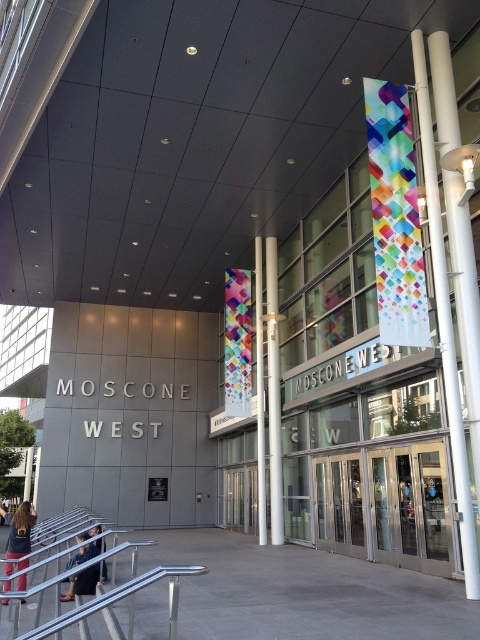
Between white glossy pillar at center and dark blue jacket at lower left, which one has less height?

dark blue jacket at lower left

Between white glossy pillar at center and dark blue jacket at lower left, which one appears on the right side from the viewer's perspective?

Positioned to the right is white glossy pillar at center.

Is point (259, 365) closer to viewer compared to point (100, 548)?

No, it is not.

You are a GUI agent. You are given a task and a screenshot of the screen. Output one action in this format:
    pyautogui.click(x=<x>, y=<y>)
    Task: Click on the white glossy pillar at center
    The image size is (480, 640).
    Given the screenshot: What is the action you would take?
    pyautogui.click(x=260, y=394)

Can you confirm if white glossy pole at center is positioned to the left of dark blue jacket at lower left?

In fact, white glossy pole at center is to the right of dark blue jacket at lower left.

Find the location of `white glossy pole at center`. white glossy pole at center is located at coordinates (274, 394).

Is point (275, 301) closer to viewer compared to point (101, 547)?

No, it is not.

Locate an element on the screen. white glossy pole at center is located at coordinates (274, 394).

Which is more to the left, white glossy pole at center or dark blue jeans at lower left?

From the viewer's perspective, dark blue jeans at lower left appears more on the left side.

Between point (277, 502) and point (90, 545), which one is positioned in front?

Point (90, 545) is in front.

At what (x,y) coordinates should I click in order to perform the action: click on white glossy pole at center. Please return your answer as a coordinate pair (x, y). Looking at the image, I should click on (274, 394).